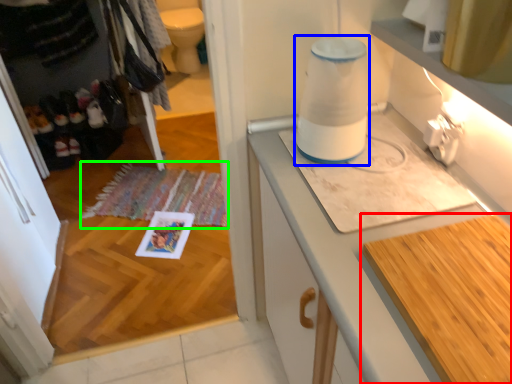
Question: Based on their relative distances, which object is farther from countertop (highlighted by a red box)? Choose from blender (highlighted by a blue box) and mat (highlighted by a green box).

Choices:
 (A) blender
 (B) mat

Answer: (B)